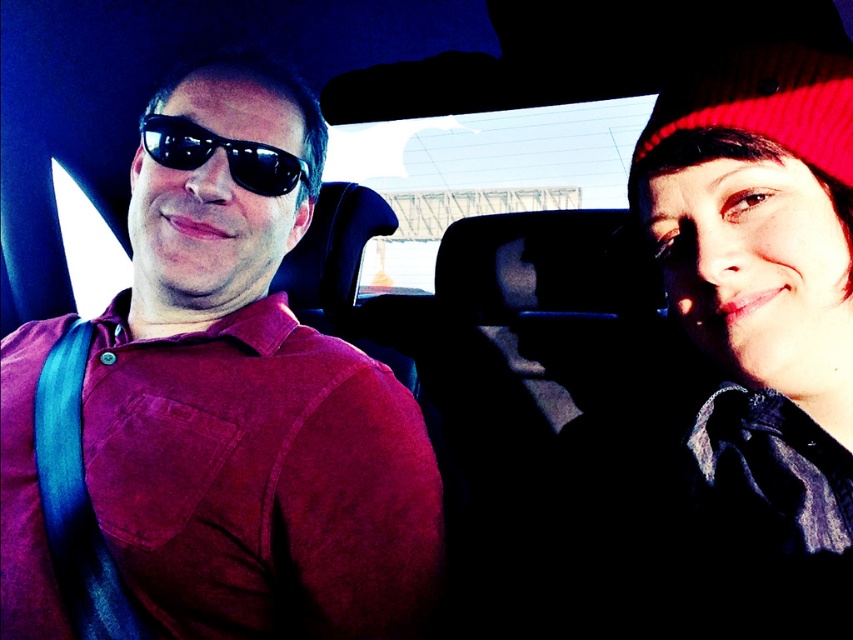
You are designing a display case for a fashion exhibit and need to place the red knit hat at upper right and the black reflective sunglasses at left. Given their sizes, which item should be placed in a smaller compartment?

The red knit hat at upper right should be placed in the smaller compartment because its width is less than the black reflective sunglasses at left.

You are a delivery driver who needs to place a 16 inch long package between the red knit hat at upper right and the other object in the car. Is there enough space?

The distance between the red knit hat at upper right and the other object is 17.17 inches, so yes, the 16 inch package can fit between them.

You are a passenger in a car and notice two red items on the front windshield. The items are the knitted red beanie at upper right and the red knit hat at upper right. Which one is positioned lower on the windshield?

The knitted red beanie at upper right is located below the red knit hat at upper right, so the knitted red beanie at upper right is positioned lower on the windshield.